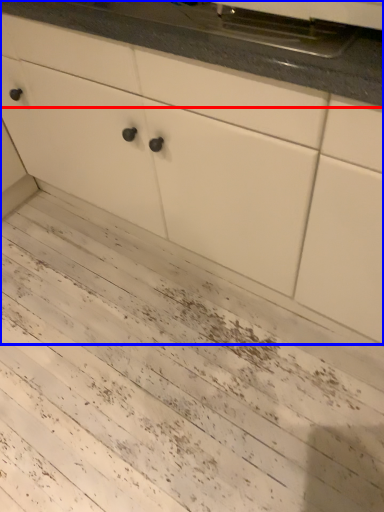
Question: Which object appears closest to the camera in this image, countertop (highlighted by a red box) or cabinetry (highlighted by a blue box)?

Choices:
 (A) countertop
 (B) cabinetry

Answer: (B)